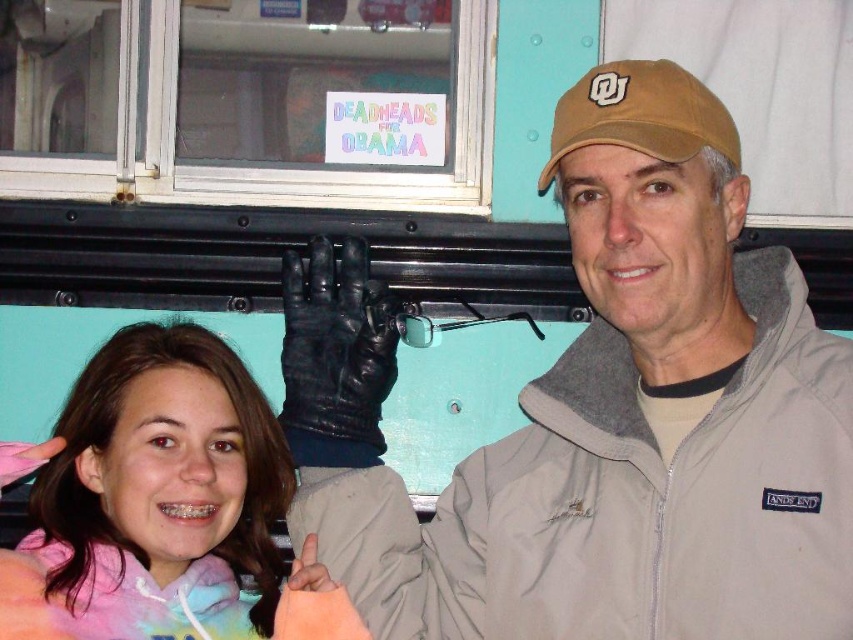
Is point (195, 349) farther from viewer compared to point (619, 97)?

Yes, it is.

Between tie-dye hoodie at lower left and brown fabric baseball cap at upper right, which one has more height?

With more height is tie-dye hoodie at lower left.

Who is more forward, (271, 508) or (717, 125)?

Point (717, 125) is more forward.

The width and height of the screenshot is (853, 640). Find the location of `tie-dye hoodie at lower left`. tie-dye hoodie at lower left is located at coordinates (161, 506).

Which is behind, point (582, 467) or point (674, 70)?

Point (582, 467)

Can you confirm if tan fabric cap at upper center is bigger than brown fabric baseball cap at upper right?

Indeed, tan fabric cap at upper center has a larger size compared to brown fabric baseball cap at upper right.

Locate an element on the screen. The width and height of the screenshot is (853, 640). tan fabric cap at upper center is located at coordinates (602, 416).

Which is in front, point (730, 148) or point (119, 531)?

Point (119, 531) is in front.

Identify the location of tan fabric cap at upper center. (602, 416).

This screenshot has width=853, height=640. Identify the location of tan fabric cap at upper center. pyautogui.click(x=602, y=416).